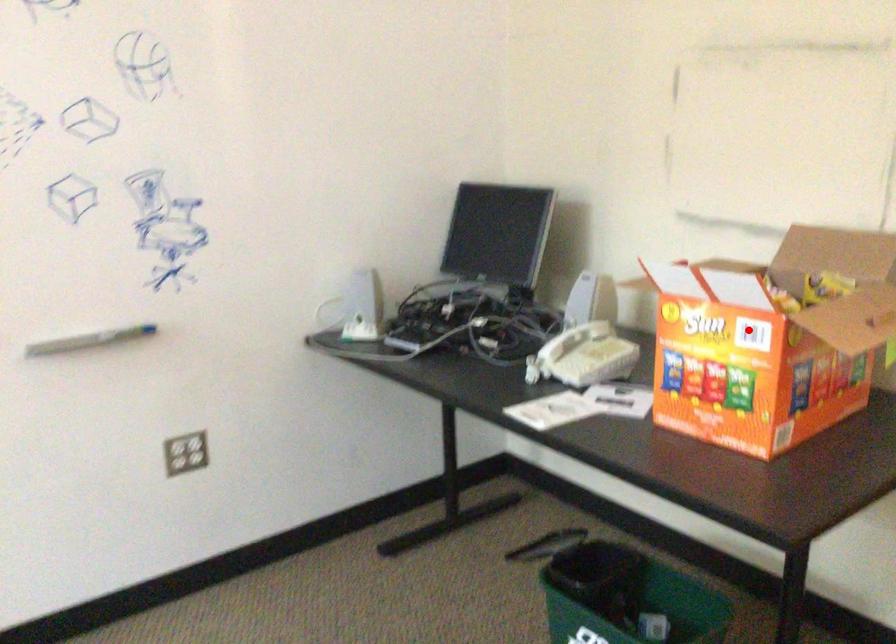
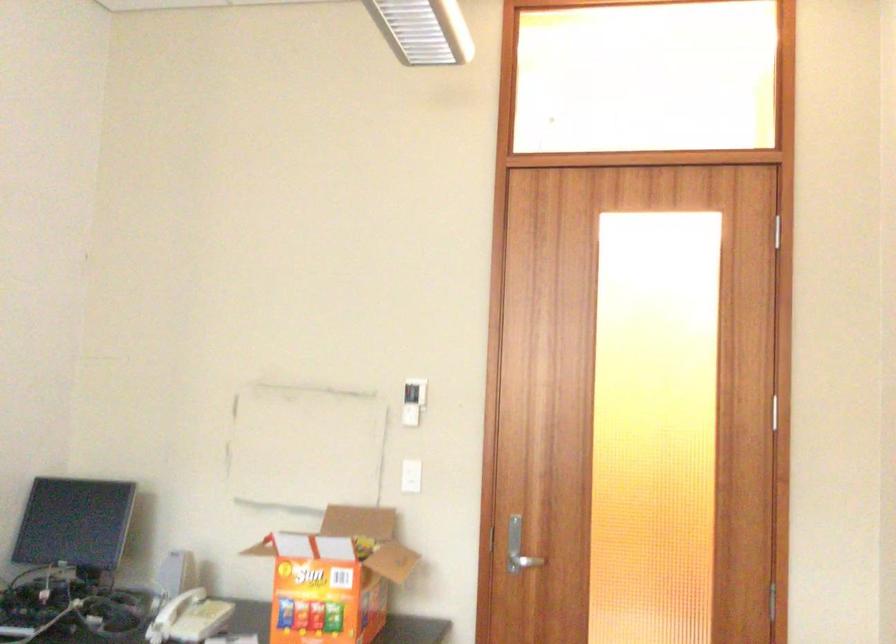
Find the pixel in the second image that matches the highlighted location in the first image.

(334, 576)